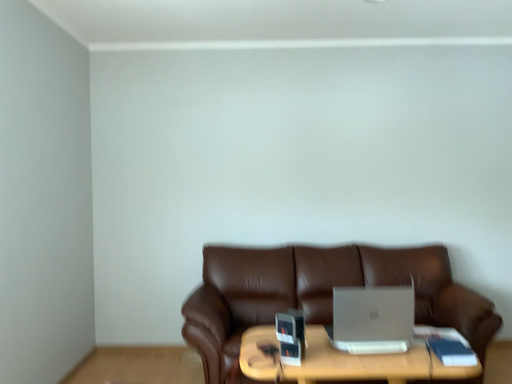
Question: From a real-world perspective, relative to brown leather couch at center, is wooden table at center vertically above or below?

Choices:
 (A) above
 (B) below

Answer: (B)

Question: Considering the positions of wooden table at center and brown leather couch at center in the image, is wooden table at center wider or thinner than brown leather couch at center?

Choices:
 (A) wide
 (B) thin

Answer: (B)

Question: Estimate the real-world distances between objects in this image. Which object is farther from the brown leather couch at center?

Choices:
 (A) wooden table at center
 (B) silver metallic laptop at center

Answer: (B)

Question: Which object is the closest to the brown leather couch at center?

Choices:
 (A) wooden table at center
 (B) silver metallic laptop at center

Answer: (A)